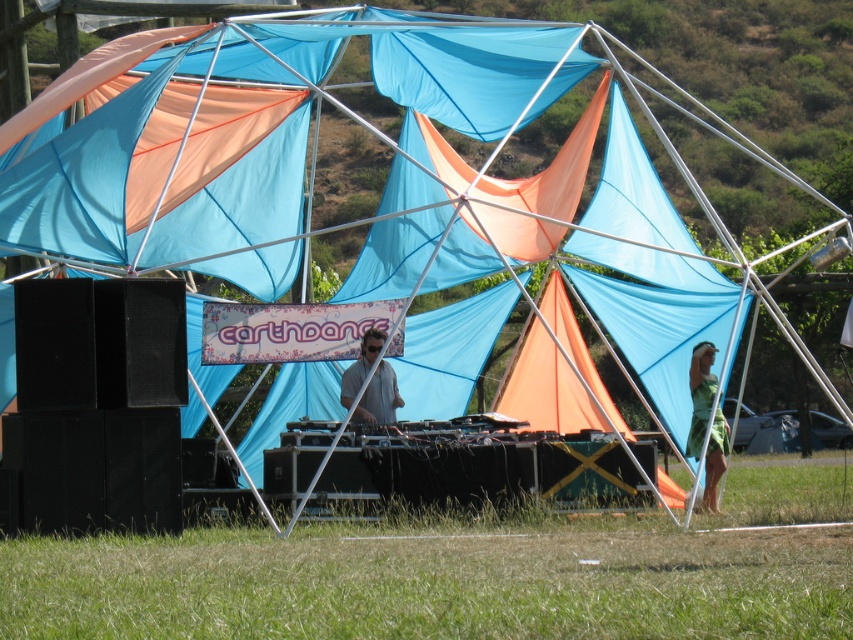
Between green fabric dress at right and matte gray shirt at center, which one has less height?

With less height is matte gray shirt at center.

Is green fabric dress at right smaller than matte gray shirt at center?

Incorrect, green fabric dress at right is not smaller in size than matte gray shirt at center.

Where is `green fabric dress at right`? green fabric dress at right is located at coordinates (700, 394).